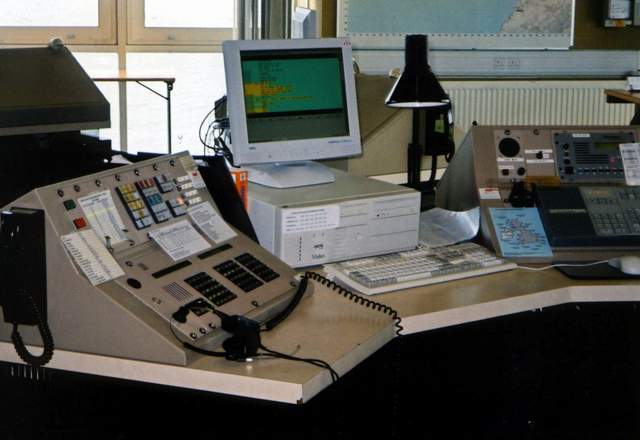
You are a GUI agent. You are given a task and a screenshot of the screen. Output one action in this format:
    pyautogui.click(x=<x>, y=<y>)
    Task: Click on the window
    
    Given the screenshot: What is the action you would take?
    pyautogui.click(x=171, y=61)